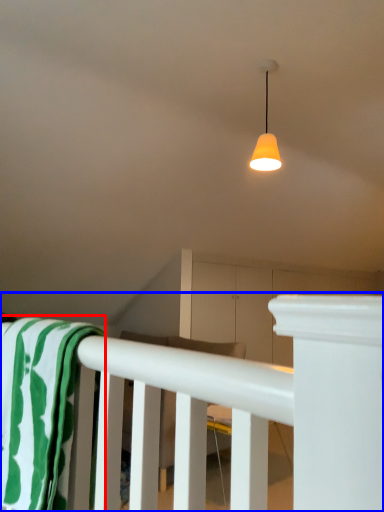
Question: Which point is further to the camera, beach towel (highlighted by a red box) or rail (highlighted by a blue box)?

Choices:
 (A) beach towel
 (B) rail

Answer: (B)